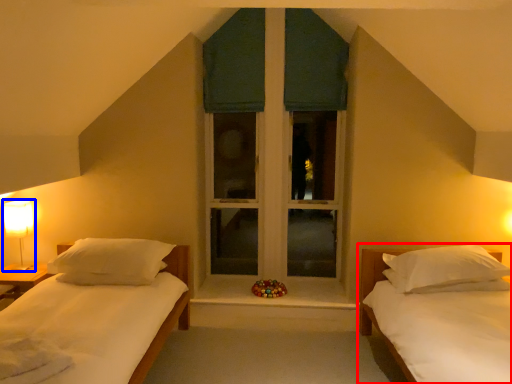
Question: Among these objects, which one is farthest to the camera, bed (highlighted by a red box) or table lamp (highlighted by a blue box)?

Choices:
 (A) bed
 (B) table lamp

Answer: (B)